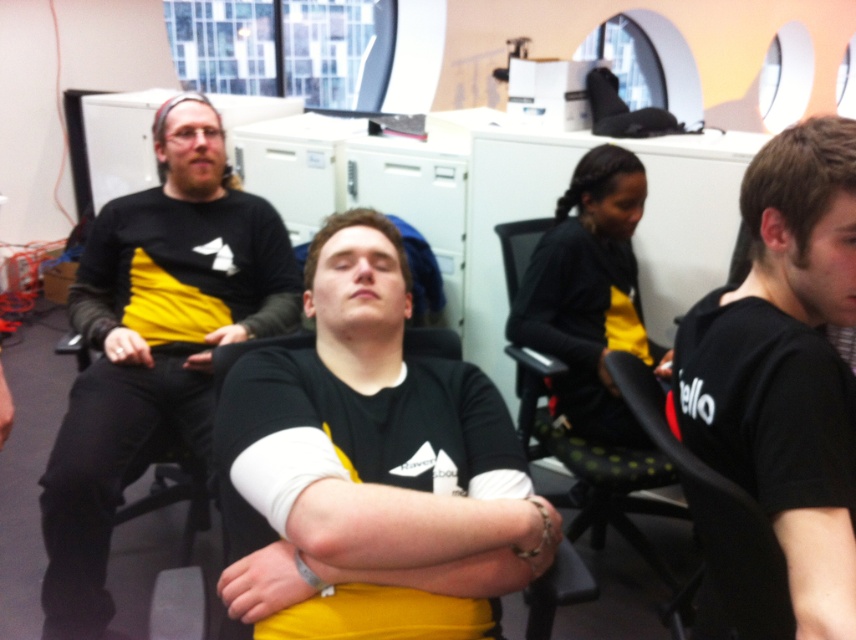
Please describe the spatial relationship between the black matte arm at right and the other objects in the scene based on their coordinates.

The black matte arm at right is located at coordinates point (810, 483), which is near the bottom right corner of the image.

You are an office worker who needs to adjust your chair to face the computer monitor located to your right. You see the black matte arm at right and the black mesh chair at center. Which object should you move to face the monitor?

You should move the black mesh chair at center to face the monitor because the black matte arm at right is positioned on the right side of it, indicating that the chair is the movable object.